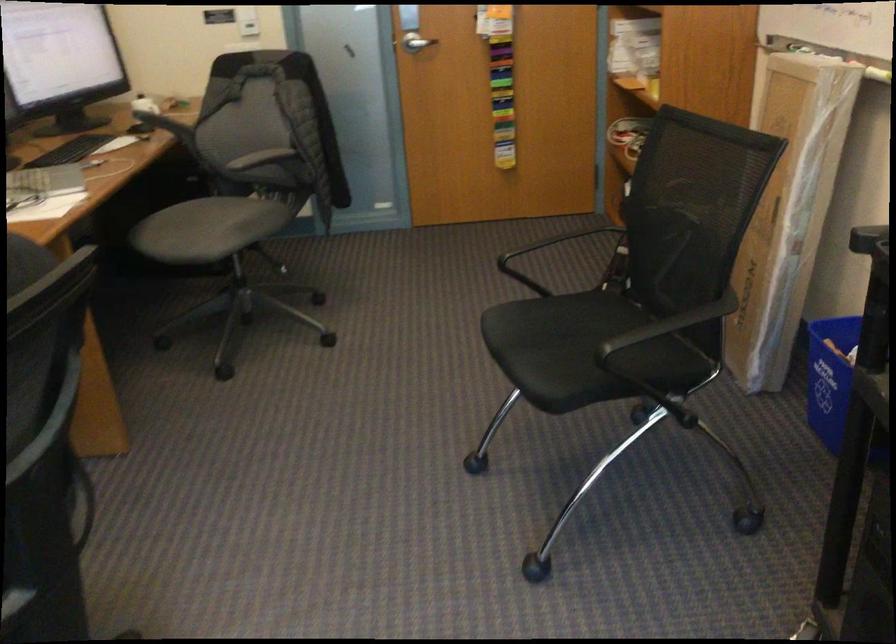
What do you see at coordinates (158, 120) in the screenshot? Image resolution: width=896 pixels, height=644 pixels. I see `the chair armrest` at bounding box center [158, 120].